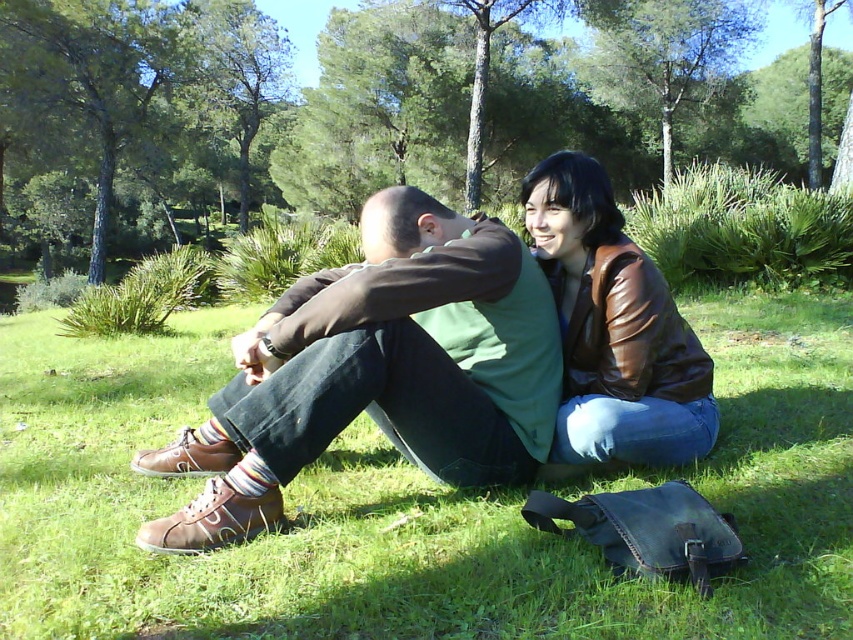
Is green leafy tree at center closer to the viewer compared to green leafy tree at upper center?

Yes, it is.

In the scene shown: Is green leafy tree at center smaller than green leafy tree at upper center?

No.

Which is in front, point (41, 84) or point (738, 19)?

Positioned in front is point (41, 84).

Where is `green leafy tree at center`? The height and width of the screenshot is (640, 853). green leafy tree at center is located at coordinates (358, 109).

How much distance is there between green leafy tree at upper left and brown leather jacket at upper right?

green leafy tree at upper left and brown leather jacket at upper right are 64.98 feet apart.

You are a GUI agent. You are given a task and a screenshot of the screen. Output one action in this format:
    pyautogui.click(x=<x>, y=<y>)
    Task: Click on the green leafy tree at upper left
    The image size is (853, 640).
    Given the screenshot: What is the action you would take?
    pyautogui.click(x=140, y=108)

Locate an element on the screen. The image size is (853, 640). green leafy tree at upper left is located at coordinates (140, 108).

Which is behind, point (569, 300) or point (706, 24)?

Positioned behind is point (706, 24).

Can you confirm if brown leather jacket at upper right is positioned below green leafy tree at upper center?

Correct, brown leather jacket at upper right is located below green leafy tree at upper center.

What do you see at coordinates (614, 328) in the screenshot? The height and width of the screenshot is (640, 853). I see `brown leather jacket at upper right` at bounding box center [614, 328].

Locate an element on the screen. The width and height of the screenshot is (853, 640). brown leather jacket at upper right is located at coordinates (614, 328).